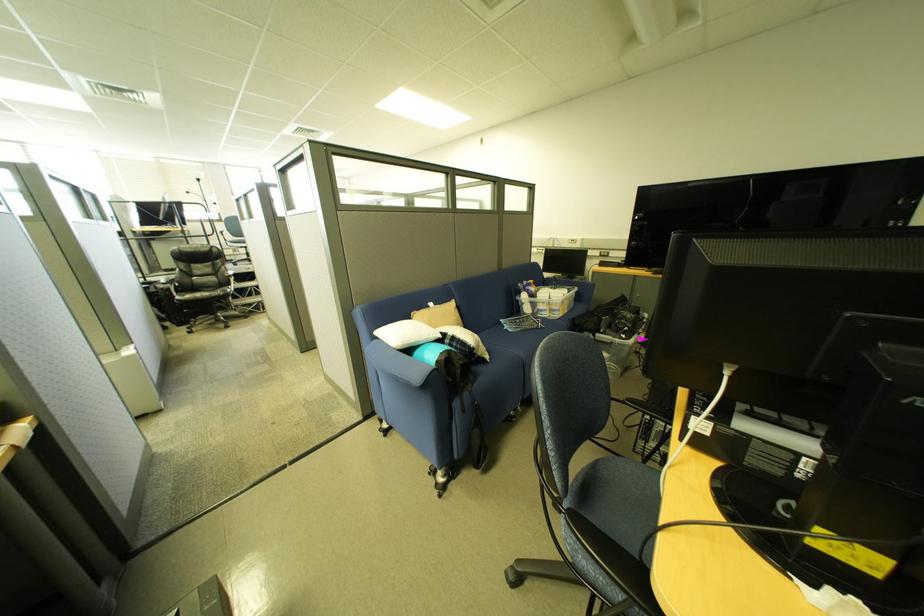
This screenshot has height=616, width=924. Describe the element at coordinates (618, 500) in the screenshot. I see `the blue chair sitting surface` at that location.